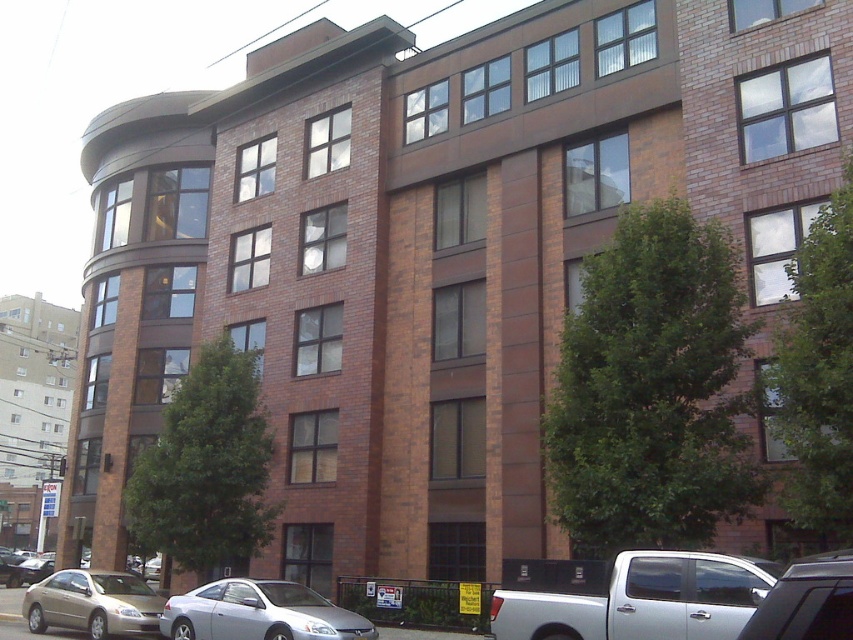
Question: Which point is farther to the camera?

Choices:
 (A) (802, 588)
 (B) (575, 612)
 (C) (93, 570)

Answer: (C)

Question: Does silver metallic car at lower center appear over matte gold sedan at lower left?

Choices:
 (A) yes
 (B) no

Answer: (A)

Question: Is silver metallic car at lower center wider than silver metallic car at lower right?

Choices:
 (A) no
 (B) yes

Answer: (B)

Question: Which is nearer to the white matte truck at lower right?

Choices:
 (A) silver metallic car at lower center
 (B) matte gold sedan at lower left

Answer: (A)

Question: Which point is closer to the camera?

Choices:
 (A) (619, 621)
 (B) (848, 614)
 (C) (213, 592)

Answer: (B)

Question: Where is white matte truck at lower right located in relation to silver metallic car at lower right in the image?

Choices:
 (A) left
 (B) right

Answer: (A)